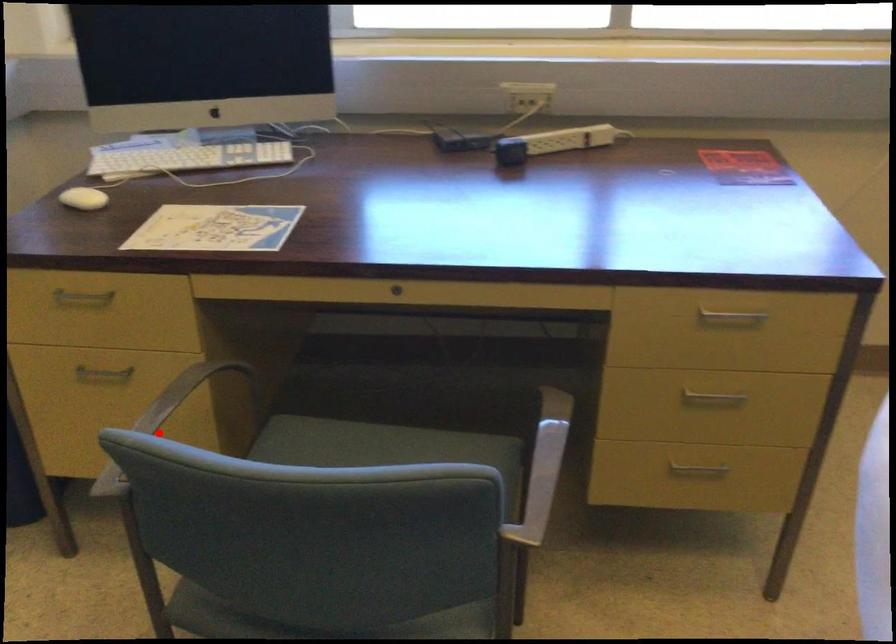
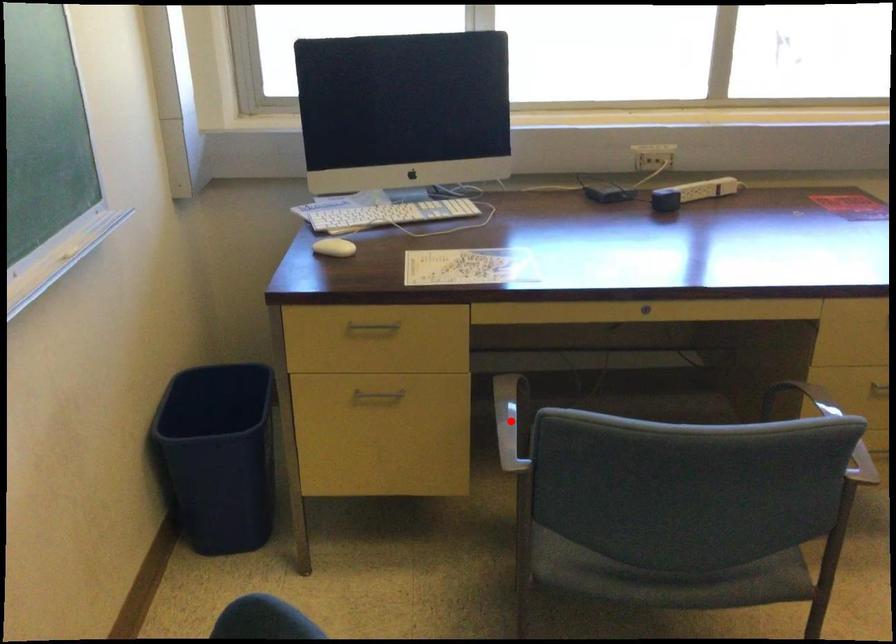
I am providing you with two images of the same scene from different viewpoints. A red point is marked on the first image and another point is marked on the second image. Does the point marked in image1 correspond to the same location as the one in image2?

Yes